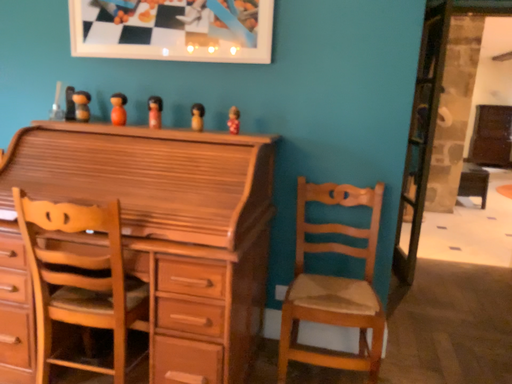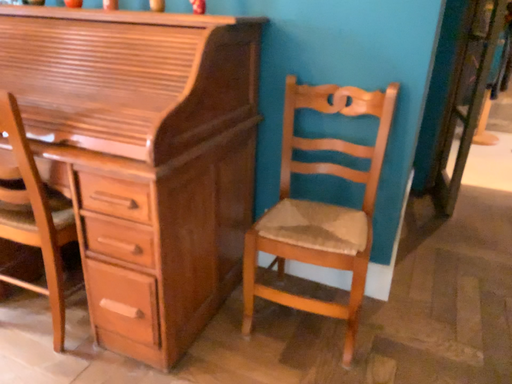
Question: Which way did the camera rotate in the video?

Choices:
 (A) rotated downward
 (B) rotated upward

Answer: (A)